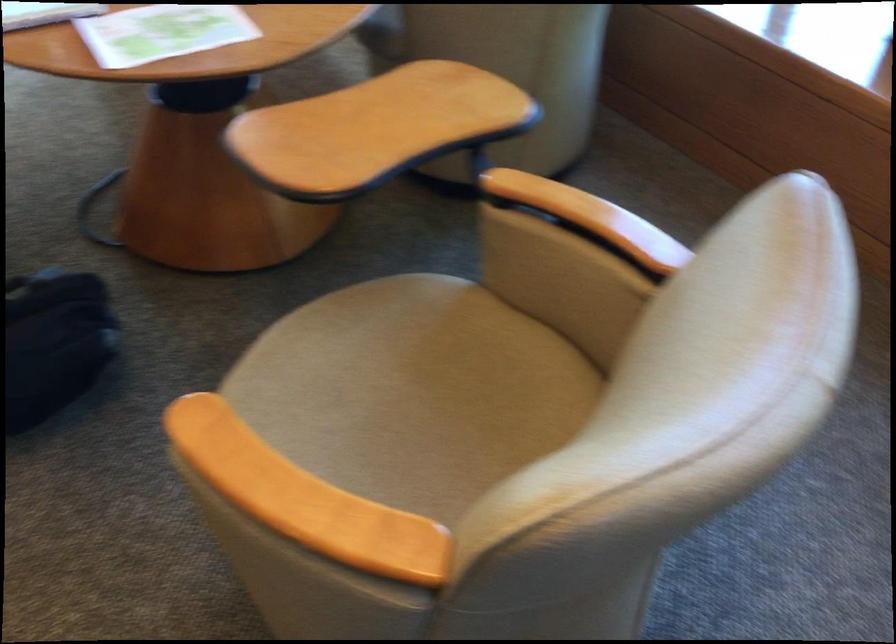
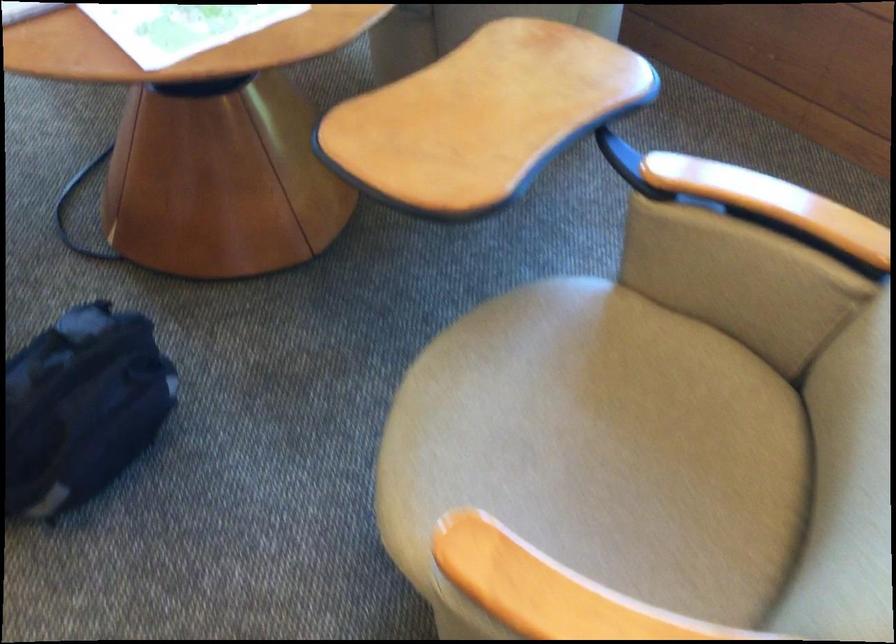
Locate, in the second image, the point that corresponds to point 401,408 in the first image.

(602, 448)